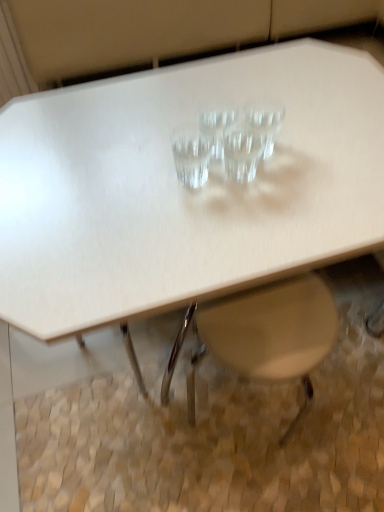
The image size is (384, 512). In order to click on white plastic swivel chair at lower center in this screenshot , I will do coord(262,334).

This screenshot has width=384, height=512. What do you see at coordinates (264, 121) in the screenshot?
I see `transparent glass martini glass at center, acting as the 4th martini glass starting from the left` at bounding box center [264, 121].

What do you see at coordinates (191, 155) in the screenshot? I see `transparent glass martini glass at center, marked as the fourth martini glass in a right-to-left arrangement` at bounding box center [191, 155].

The width and height of the screenshot is (384, 512). What do you see at coordinates (216, 126) in the screenshot?
I see `transparent glass martini glass at center, placed as the third martini glass when sorted from right to left` at bounding box center [216, 126].

At what (x,y) coordinates should I click in order to perform the action: click on white plastic swivel chair at lower center. Please return your answer as a coordinate pair (x, y). This screenshot has height=512, width=384. Looking at the image, I should click on (262, 334).

Does transparent glass martini glass at center, acting as the first martini glass starting from the left, touch transparent glass martini at center, which is the 3th martini glass in left-to-right order?

Indeed, transparent glass martini glass at center, acting as the first martini glass starting from the left, and transparent glass martini at center, which is the 3th martini glass in left-to-right order, are beside each other and touching.

From a real-world perspective, which object rests below the other?

transparent glass martini at center, which is the 2th martini glass from right to left, is physically lower.

Image resolution: width=384 pixels, height=512 pixels. Find the location of `martini glass in front of the transparent glass martini at center, which is the 2th martini glass from right to left`. martini glass in front of the transparent glass martini at center, which is the 2th martini glass from right to left is located at coordinates (191, 155).

Considering their positions, is transparent glass martini glass at center, acting as the first martini glass starting from the left, located in front of or behind transparent glass martini at center, which is the 2th martini glass from right to left?

Clearly, transparent glass martini glass at center, acting as the first martini glass starting from the left, is in front of transparent glass martini at center, which is the 2th martini glass from right to left.

Considering the positions of points (218, 147) and (228, 156), is point (218, 147) farther from camera compared to point (228, 156)?

Yes, it is.

Would you say transparent glass martini glass at center, placed as the third martini glass when sorted from right to left, is outside transparent glass martini at center, which is the 3th martini glass in left-to-right order?

That's correct, transparent glass martini glass at center, placed as the third martini glass when sorted from right to left, is outside of transparent glass martini at center, which is the 3th martini glass in left-to-right order.

From the image's perspective, which one is positioned higher, transparent glass martini glass at center, which is the second martini glass from left to right, or transparent glass martini at center, which is the 3th martini glass in left-to-right order?

transparent glass martini glass at center, which is the second martini glass from left to right, appears higher in the image.

Which is behind, transparent glass martini glass at center, which is the second martini glass from left to right, or transparent glass martini at center, which is the 3th martini glass in left-to-right order?

transparent glass martini glass at center, which is the second martini glass from left to right, is further away from the camera.

Which is less distant, (243, 141) or (221, 126)?

The point (243, 141) is closer to the camera.

From a real-world perspective, who is located lower, transparent glass martini at center, which is the 2th martini glass from right to left, or transparent glass martini glass at center, placed as the third martini glass when sorted from right to left?

In real-world perspective, transparent glass martini at center, which is the 2th martini glass from right to left, is lower.

Locate an element on the screen. the 1st martini glass above the transparent glass martini at center, which is the 2th martini glass from right to left (from the image's perspective) is located at coordinates (216, 126).

Is transparent glass martini at center, which is the 2th martini glass from right to left, facing away from transparent glass martini glass at center, which is the second martini glass from left to right?

transparent glass martini at center, which is the 2th martini glass from right to left, is not turned away from transparent glass martini glass at center, which is the second martini glass from left to right.

Does point (233, 140) lie behind point (196, 152)?

Yes, it is.

Is transparent glass martini glass at center, marked as the fourth martini glass in a right-to-left arrangement, at the back of transparent glass martini at center, which is the 3th martini glass in left-to-right order?

No, transparent glass martini at center, which is the 3th martini glass in left-to-right order, is not facing away from transparent glass martini glass at center, marked as the fourth martini glass in a right-to-left arrangement.

What's the angular difference between transparent glass martini at center, which is the 3th martini glass in left-to-right order, and transparent glass martini glass at center, marked as the fourth martini glass in a right-to-left arrangement,'s facing directions?

0 degrees separate the facing orientations of transparent glass martini at center, which is the 3th martini glass in left-to-right order, and transparent glass martini glass at center, marked as the fourth martini glass in a right-to-left arrangement.

There is a transparent glass martini glass at center, acting as the first martini glass starting from the left. Where is `the 1st martini glass above it (from the image's perspective)`? the 1st martini glass above it (from the image's perspective) is located at coordinates (242, 154).

In the image, is transparent glass martini glass at center, acting as the first martini glass starting from the left, on the left side or the right side of white plastic swivel chair at lower center?

Clearly, transparent glass martini glass at center, acting as the first martini glass starting from the left, is on the left of white plastic swivel chair at lower center in the image.

Could you tell me if transparent glass martini glass at center, acting as the first martini glass starting from the left, is turned towards white plastic swivel chair at lower center?

No, transparent glass martini glass at center, acting as the first martini glass starting from the left, is not facing towards white plastic swivel chair at lower center.

Which object is closer to the camera, transparent glass martini glass at center, marked as the fourth martini glass in a right-to-left arrangement, or white plastic swivel chair at lower center?

transparent glass martini glass at center, marked as the fourth martini glass in a right-to-left arrangement, is closer to the camera.

From a real-world perspective, is transparent glass martini glass at center, acting as the first martini glass starting from the left, on white plastic swivel chair at lower center?

Indeed, from a real-world perspective, transparent glass martini glass at center, acting as the first martini glass starting from the left, stands above white plastic swivel chair at lower center.

Relative to transparent glass martini glass at center, acting as the 1th martini glass starting from the right, is white plastic swivel chair at lower center in front or behind?

white plastic swivel chair at lower center is in front of transparent glass martini glass at center, acting as the 1th martini glass starting from the right.

Which is more to the left, white plastic swivel chair at lower center or transparent glass martini glass at center, acting as the 1th martini glass starting from the right?

Positioned to the left is white plastic swivel chair at lower center.

Are transparent glass martini glass at center, acting as the 1th martini glass starting from the right, and white plastic swivel chair at lower center far apart?

That's not correct — transparent glass martini glass at center, acting as the 1th martini glass starting from the right, is a little close to white plastic swivel chair at lower center.

How different are the orientations of transparent glass martini glass at center, acting as the 1th martini glass starting from the right, and white plastic swivel chair at lower center in degrees?

They differ by 178 degrees in their facing directions.

Considering the positions of point (263, 100) and point (274, 314), is point (263, 100) closer or farther from the camera than point (274, 314)?

Point (263, 100) appears to be farther away from the viewer than point (274, 314).

From a real-world perspective, is transparent glass martini glass at center, acting as the 1th martini glass starting from the right, positioned over white plastic swivel chair at lower center based on gravity?

Correct, in the physical world, transparent glass martini glass at center, acting as the 1th martini glass starting from the right, is higher than white plastic swivel chair at lower center.

From a real-world perspective, count 3rd martini glasss upward from the transparent glass martini at center, which is the 2th martini glass from right to left, and point to it. Please provide its 2D coordinates.

[(191, 155)]

Image resolution: width=384 pixels, height=512 pixels. What are the coordinates of `the 1st martini glass below the transparent glass martini glass at center, which is the second martini glass from left to right (from the image's perspective)` in the screenshot? It's located at (242, 154).

Looking at the image, which one is located closer to transparent glass martini glass at center, acting as the 1th martini glass starting from the right, transparent glass martini glass at center, placed as the third martini glass when sorted from right to left, or transparent glass martini at center, which is the 3th martini glass in left-to-right order?

transparent glass martini at center, which is the 3th martini glass in left-to-right order, lies closer to transparent glass martini glass at center, acting as the 1th martini glass starting from the right, than the other object.

Which object lies further to the anchor point white plastic swivel chair at lower center, transparent glass martini glass at center, marked as the fourth martini glass in a right-to-left arrangement, or transparent glass martini at center, which is the 2th martini glass from right to left?

transparent glass martini glass at center, marked as the fourth martini glass in a right-to-left arrangement.

Considering their positions, is transparent glass martini glass at center, placed as the third martini glass when sorted from right to left, positioned further to transparent glass martini glass at center, acting as the 4th martini glass starting from the left, than white plastic swivel chair at lower center?

white plastic swivel chair at lower center is positioned further to the anchor transparent glass martini glass at center, acting as the 4th martini glass starting from the left.

Considering their positions, is transparent glass martini glass at center, placed as the third martini glass when sorted from right to left, positioned closer to transparent glass martini glass at center, marked as the fourth martini glass in a right-to-left arrangement, than white plastic swivel chair at lower center?

transparent glass martini glass at center, placed as the third martini glass when sorted from right to left, is positioned closer to the anchor transparent glass martini glass at center, marked as the fourth martini glass in a right-to-left arrangement.

Looking at this image, when comparing their distances from transparent glass martini at center, which is the 2th martini glass from right to left, does transparent glass martini glass at center, acting as the first martini glass starting from the left, or transparent glass martini glass at center, acting as the 1th martini glass starting from the right, seem further?

transparent glass martini glass at center, acting as the first martini glass starting from the left, is further to transparent glass martini at center, which is the 2th martini glass from right to left.

From the image, which object appears to be nearer to transparent glass martini glass at center, marked as the fourth martini glass in a right-to-left arrangement, transparent glass martini glass at center, which is the second martini glass from left to right, or transparent glass martini glass at center, acting as the 1th martini glass starting from the right?

The object closer to transparent glass martini glass at center, marked as the fourth martini glass in a right-to-left arrangement, is transparent glass martini glass at center, which is the second martini glass from left to right.

Estimate the real-world distances between objects in this image. Which object is closer to transparent glass martini glass at center, acting as the 4th martini glass starting from the left, transparent glass martini at center, which is the 2th martini glass from right to left, or transparent glass martini glass at center, which is the second martini glass from left to right?

Among the two, transparent glass martini at center, which is the 2th martini glass from right to left, is located nearer to transparent glass martini glass at center, acting as the 4th martini glass starting from the left.

Looking at the image, which one is located closer to white plastic swivel chair at lower center, transparent glass martini glass at center, marked as the fourth martini glass in a right-to-left arrangement, or transparent glass martini glass at center, placed as the third martini glass when sorted from right to left?

Based on the image, transparent glass martini glass at center, marked as the fourth martini glass in a right-to-left arrangement, appears to be nearer to white plastic swivel chair at lower center.

Identify the location of martini glass between transparent glass martini glass at center, placed as the third martini glass when sorted from right to left, and transparent glass martini glass at center, acting as the 1th martini glass starting from the right, in the horizontal direction. This screenshot has width=384, height=512. (242, 154).

The height and width of the screenshot is (512, 384). I want to click on martini glass between transparent glass martini at center, which is the 3th martini glass in left-to-right order, and white plastic swivel chair at lower center in the up-down direction, so click(191, 155).

This screenshot has height=512, width=384. What are the coordinates of `martini glass between transparent glass martini glass at center, marked as the fourth martini glass in a right-to-left arrangement, and transparent glass martini at center, which is the 2th martini glass from right to left, in the horizontal direction` in the screenshot? It's located at (216, 126).